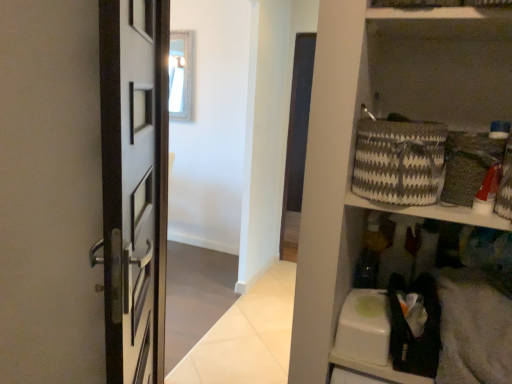
Question: Relative to wooden frame mirror at upper center, is white glossy wall at upper center in front or behind?

Choices:
 (A) front
 (B) behind

Answer: (A)

Question: Based on their positions, is white glossy wall at upper center located to the left or right of wooden frame mirror at upper center?

Choices:
 (A) right
 (B) left

Answer: (A)

Question: Considering the real-world distances, which object is closest to the wooden frame mirror at upper center?

Choices:
 (A) white glossy wall at upper center
 (B) gray and white woven basket at upper right

Answer: (A)

Question: Which object is positioned farthest from the wooden frame mirror at upper center?

Choices:
 (A) white glossy wall at upper center
 (B) gray and white woven basket at upper right

Answer: (B)